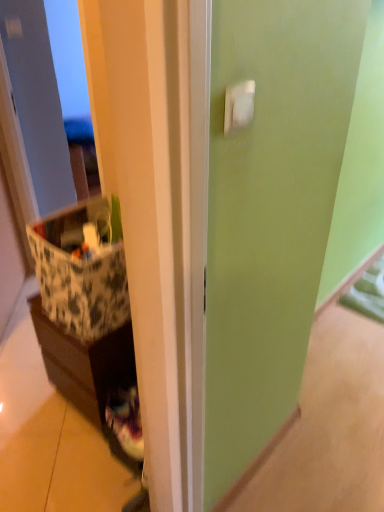
Question: Is brown matte cabinet at left inside the boundaries of patterned fabric storage box at left, or outside?

Choices:
 (A) inside
 (B) outside

Answer: (B)

Question: From a real-world perspective, is brown matte cabinet at left physically located above or below patterned fabric storage box at left?

Choices:
 (A) below
 (B) above

Answer: (A)

Question: Considering the positions of point (107, 368) and point (39, 259), is point (107, 368) closer or farther from the camera than point (39, 259)?

Choices:
 (A) farther
 (B) closer

Answer: (A)

Question: Considering the positions of patterned fabric storage box at left and brown matte cabinet at left in the image, is patterned fabric storage box at left bigger or smaller than brown matte cabinet at left?

Choices:
 (A) big
 (B) small

Answer: (B)

Question: Visually, is patterned fabric storage box at left positioned to the left or to the right of brown matte cabinet at left?

Choices:
 (A) left
 (B) right

Answer: (B)

Question: From the image's perspective, is patterned fabric storage box at left located above or below brown matte cabinet at left?

Choices:
 (A) below
 (B) above

Answer: (B)

Question: From a real-world perspective, is patterned fabric storage box at left above or below brown matte cabinet at left?

Choices:
 (A) below
 (B) above

Answer: (B)